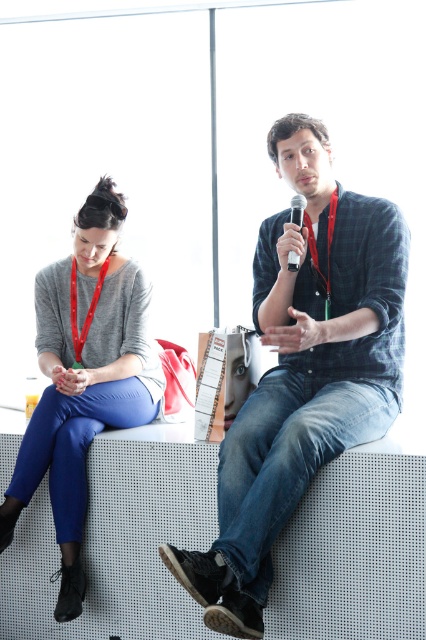
Image resolution: width=426 pixels, height=640 pixels. What are the coordinates of `red fabric lanyard at upper center` in the screenshot? It's located at (316, 252).

Can you confirm if red fabric lanyard at upper center is shorter than red fabric lanyard at upper left?

In fact, red fabric lanyard at upper center may be taller than red fabric lanyard at upper left.

Between point (302, 216) and point (74, 292), which one is positioned in front?

Point (302, 216)

The width and height of the screenshot is (426, 640). Find the location of `red fabric lanyard at upper center`. red fabric lanyard at upper center is located at coordinates (316, 252).

This screenshot has width=426, height=640. Describe the element at coordinates (302, 372) in the screenshot. I see `denim jeans at center` at that location.

Is denim jeans at center behind matte gray sweater at left?

No, it is not.

Is point (264, 376) more distant than point (106, 340)?

No, (264, 376) is closer to viewer.

Where is `denim jeans at center`? The width and height of the screenshot is (426, 640). denim jeans at center is located at coordinates (302, 372).

Which is in front, point (238, 438) or point (330, 284)?

Point (238, 438) is more forward.

The height and width of the screenshot is (640, 426). Describe the element at coordinates (302, 372) in the screenshot. I see `denim jeans at center` at that location.

You are a GUI agent. You are given a task and a screenshot of the screen. Output one action in this format:
    pyautogui.click(x=<x>, y=<y>)
    Task: Click on the denim jeans at center
    The width and height of the screenshot is (426, 640).
    Given the screenshot: What is the action you would take?
    pyautogui.click(x=302, y=372)